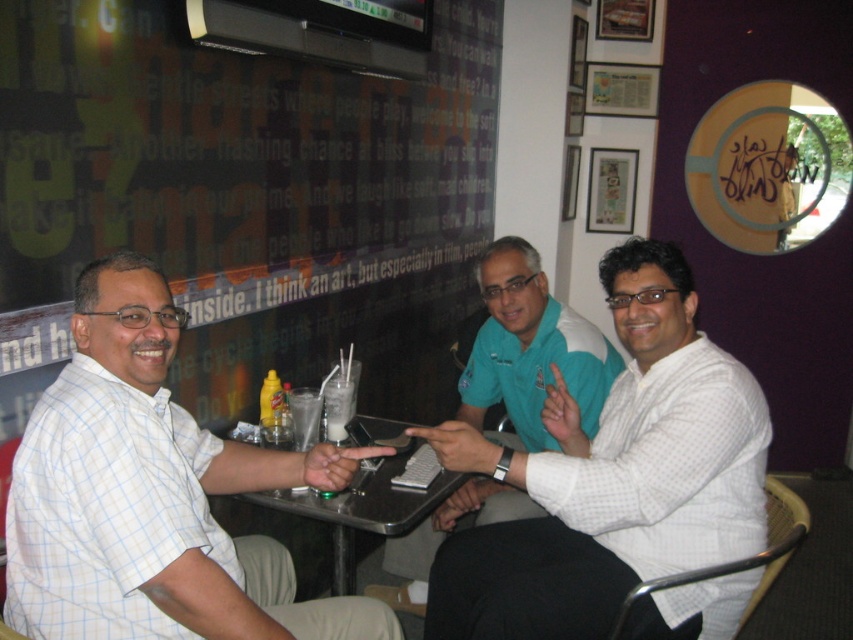
Is metallic silver tray at center to the right of white frothy milkshake at center from the viewer's perspective?

Incorrect, metallic silver tray at center is not on the right side of white frothy milkshake at center.

Can you confirm if metallic silver tray at center is taller than white frothy milkshake at center?

Yes.

This screenshot has height=640, width=853. Identify the location of metallic silver tray at center. (363, 509).

Describe the element at coordinates (305, 417) in the screenshot. This screenshot has width=853, height=640. I see `milky white smoothie at center` at that location.

Is milky white smoothie at center wider than white frothy milkshake at center?

Indeed, milky white smoothie at center has a greater width compared to white frothy milkshake at center.

At what (x,y) coordinates should I click in order to perform the action: click on milky white smoothie at center. Please return your answer as a coordinate pair (x, y). The width and height of the screenshot is (853, 640). Looking at the image, I should click on (305, 417).

At what (x,y) coordinates should I click in order to perform the action: click on milky white smoothie at center. Please return your answer as a coordinate pair (x, y). The height and width of the screenshot is (640, 853). Looking at the image, I should click on (305, 417).

Is point (566, 532) positioned behind point (306, 435)?

No, it is in front of (306, 435).

Does white checkered shirt at center have a larger size compared to milky white smoothie at center?

Indeed, white checkered shirt at center has a larger size compared to milky white smoothie at center.

Between point (653, 433) and point (306, 388), which one is positioned behind?

Positioned behind is point (306, 388).

Find the location of `white checkered shirt at center`. white checkered shirt at center is located at coordinates (613, 476).